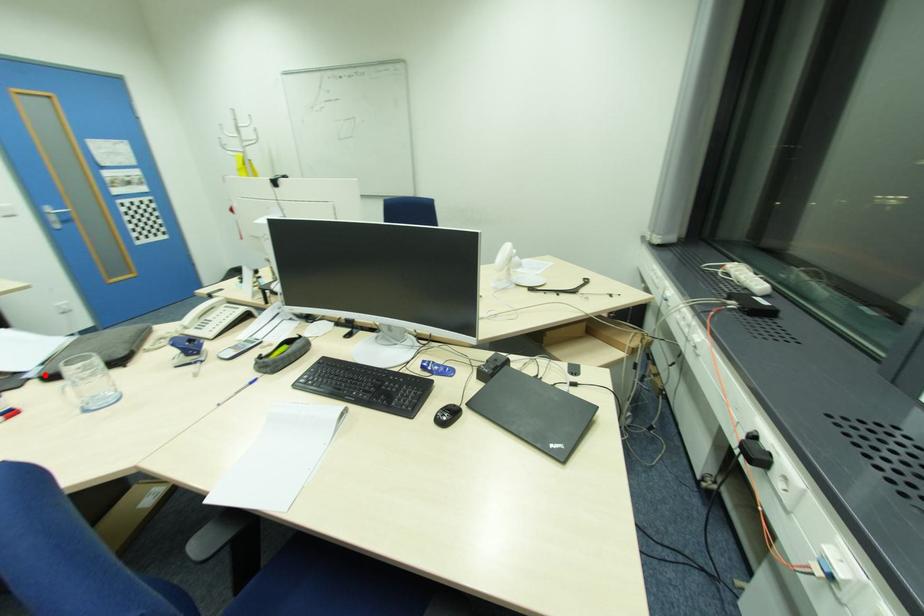
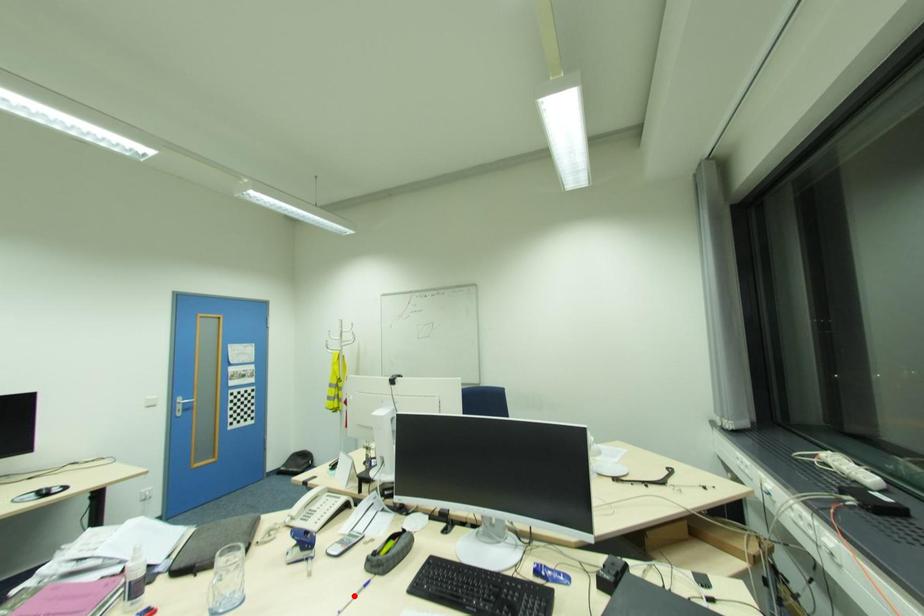
I am providing you with two images of the same scene from different viewpoints. A red point is marked on the first image and another point is marked on the second image. Does the point marked in image1 correspond to the same location as the one in image2?

No